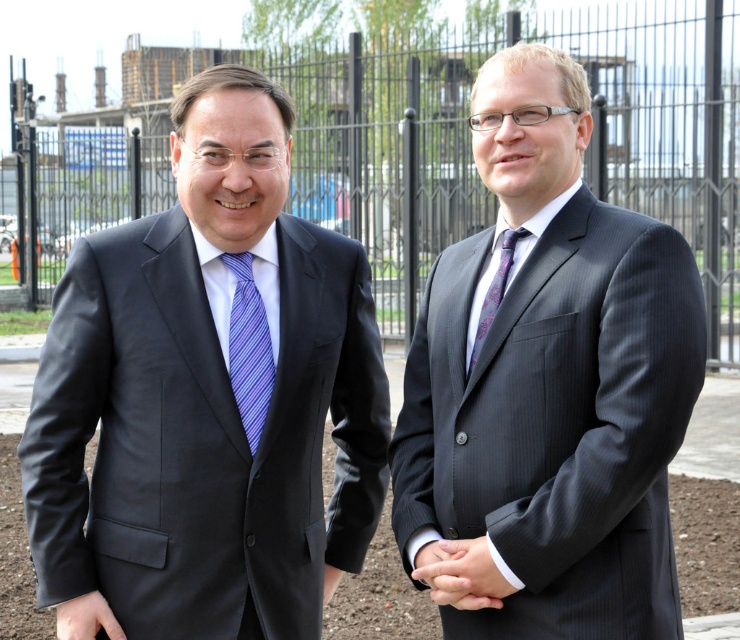
Question: Which object appears closest to the camera in this image?

Choices:
 (A) matte black suit at left
 (B) purple silk tie at center
 (C) black metal fence at center

Answer: (C)

Question: Which is farther from the black silk hand at center?

Choices:
 (A) matte black suit at right
 (B) black metal fence at center
 (C) purple striped tie at left
 (D) matte black suit at left

Answer: (B)

Question: Can you confirm if purple striped tie at left is positioned below purple silk tie at center?

Choices:
 (A) yes
 (B) no

Answer: (A)

Question: Which object appears closest to the camera in this image?

Choices:
 (A) black metal fence at center
 (B) purple silk tie at center
 (C) purple striped tie at left

Answer: (A)

Question: Can you confirm if black silk hand at center is wider than matte black hand at lower left?

Choices:
 (A) no
 (B) yes

Answer: (B)

Question: Is the position of matte black suit at right less distant than that of purple silk tie at center?

Choices:
 (A) yes
 (B) no

Answer: (A)